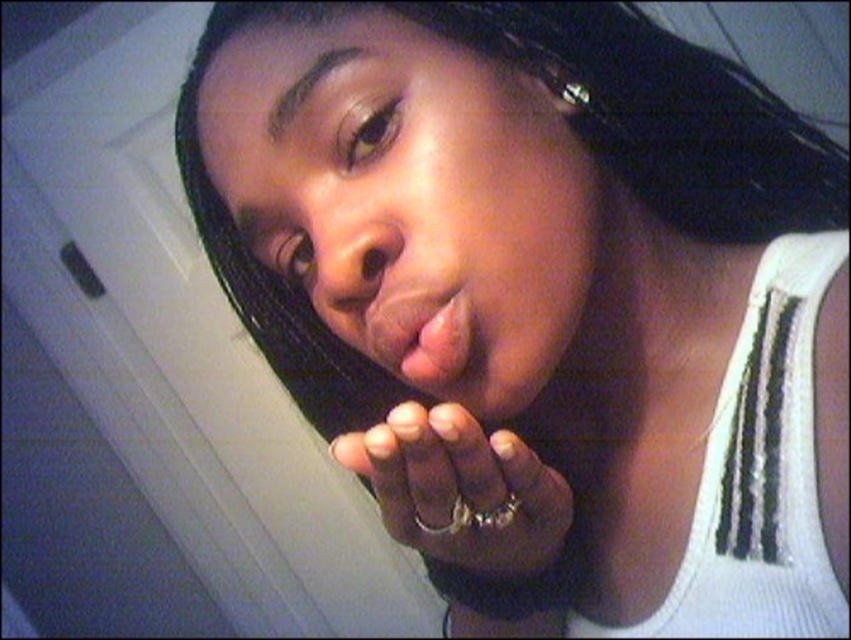
You are holding a 12 inch ruler and want to measure the distance between your eyes and the point at coordinates point (387, 332) in the image. Can you fit the ruler between your eyes and the point?

The distance between your eyes and the point at coordinates point (387, 332) is 14.25 inches, so yes, the 12 inch ruler can fit between your eyes and the point since it is shorter than the distance.

Looking at this image, you are designing a virtual reality simulation of this scene. To accurately place a virtual object at the same position as the metallic ring at center, what coordinates should you use?

The metallic ring at center should be placed at coordinates point (x=460, y=490).

You are standing in the room and notice two points in the image. The first point is at coordinates point (387,148) and the second is at point (432,554). Which point is nearer to you?

Point (387,148) is closer to the viewer than point (432,554).